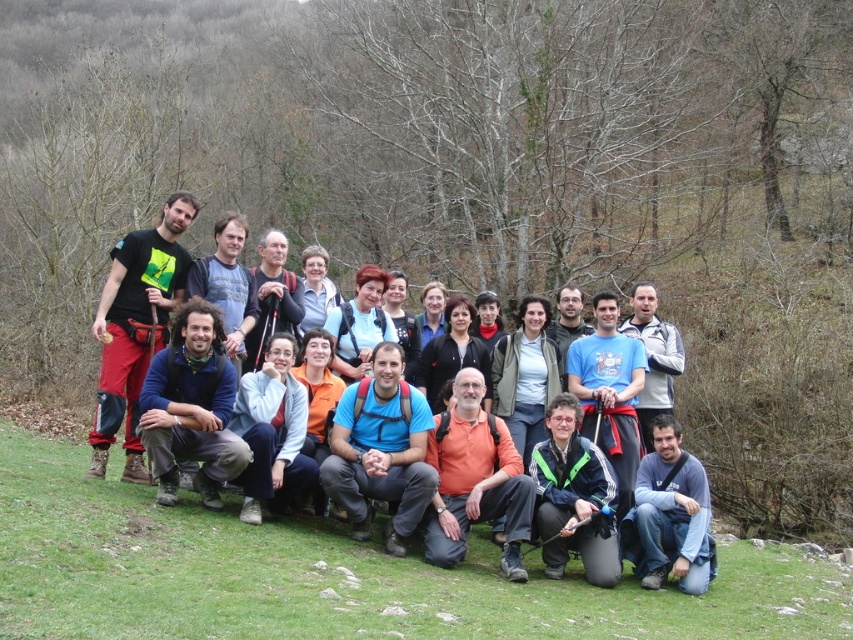
Does matte black backpack at center lie behind dark blue t-shirt at lower right?

That is True.

Image resolution: width=853 pixels, height=640 pixels. What do you see at coordinates (172, 307) in the screenshot?
I see `matte black backpack at center` at bounding box center [172, 307].

Where is `matte black backpack at center`? Image resolution: width=853 pixels, height=640 pixels. matte black backpack at center is located at coordinates (172, 307).

Where is `matte black backpack at center`? matte black backpack at center is located at coordinates (172, 307).